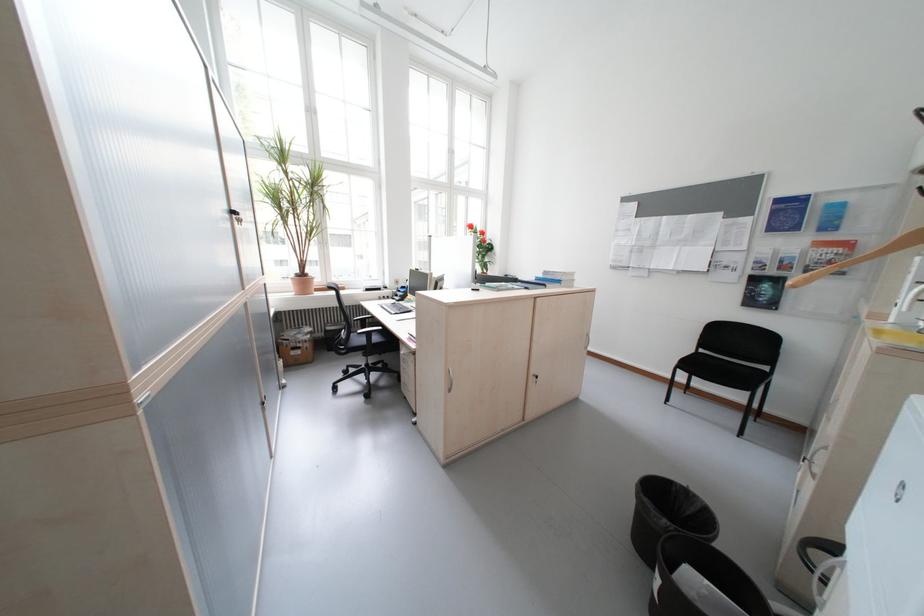
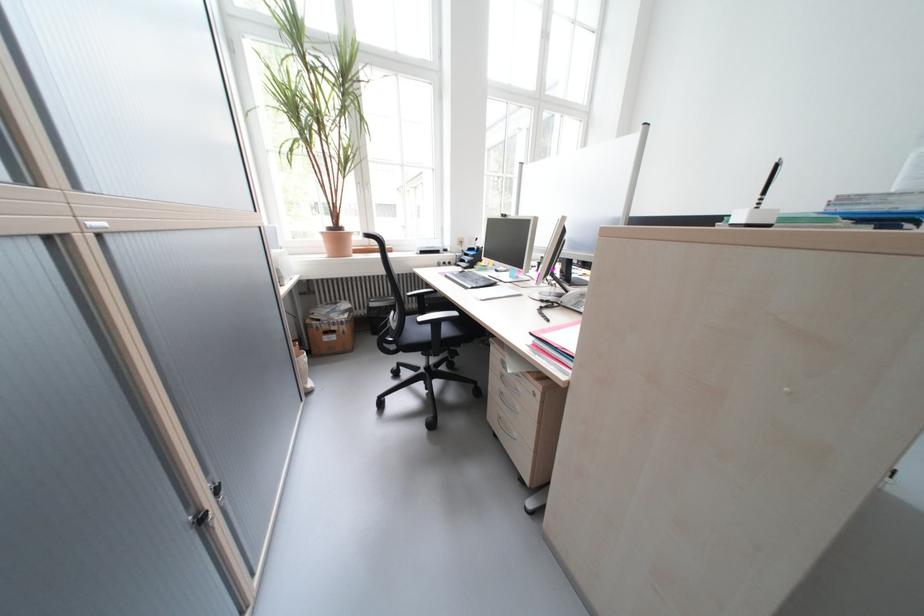
What movement of the cameraman would produce the second image?

The cameraman moved toward left, forward.